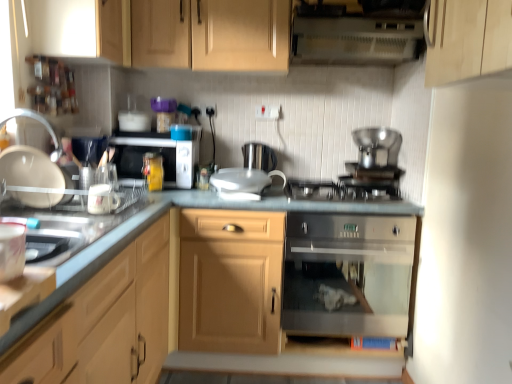
What is the approximate width of wooden cabinet at upper center, marked as the fourth cabinetry in a bottom-to-top arrangement?

24.74 inches.

Image resolution: width=512 pixels, height=384 pixels. What do you see at coordinates (376, 154) in the screenshot?
I see `satin silver pot at center, the 3th appliance positioned from the front` at bounding box center [376, 154].

What is the approximate height of light wood cabinet at upper left, which is the second cabinetry in top-to-bottom order?

light wood cabinet at upper left, which is the second cabinetry in top-to-bottom order, is 13.03 inches tall.

Identify the location of light wood cabinet at upper left, which is the second cabinetry in top-to-bottom order. (83, 29).

What is the approximate width of stainless steel gas stove at center?

stainless steel gas stove at center is 20.91 inches wide.

What do you see at coordinates (348, 273) in the screenshot? I see `stainless steel oven at center` at bounding box center [348, 273].

The height and width of the screenshot is (384, 512). Identify the location of matte white mug at left, the 1th appliance positioned from the front. (12, 250).

Where is `wooden cabinet at upper center, which is counted as the first cabinetry, starting from the top`? The width and height of the screenshot is (512, 384). wooden cabinet at upper center, which is counted as the first cabinetry, starting from the top is located at coordinates (169, 33).

Is wooden cabinet at upper center, marked as the fourth cabinetry in a bottom-to-top arrangement, inside the boundaries of white glossy plate at left, or outside?

wooden cabinet at upper center, marked as the fourth cabinetry in a bottom-to-top arrangement, is spatially situated outside white glossy plate at left.

Based on the photo, can you tell me how much wooden cabinet at upper center, marked as the fourth cabinetry in a bottom-to-top arrangement, and white glossy plate at left differ in facing direction?

There is a 90-degree angle between the facing directions of wooden cabinet at upper center, marked as the fourth cabinetry in a bottom-to-top arrangement, and white glossy plate at left.

From a real-world perspective, is wooden cabinet at upper center, marked as the fourth cabinetry in a bottom-to-top arrangement, on top of white glossy plate at left?

Yes, from a real-world perspective, wooden cabinet at upper center, marked as the fourth cabinetry in a bottom-to-top arrangement, is over white glossy plate at left

Can you confirm if matte white mug at left, placed as the 2th appliance when sorted from right to left, is bigger than satin silver pot at center, arranged as the first appliance when viewed from the top?

Actually, matte white mug at left, placed as the 2th appliance when sorted from right to left, might be smaller than satin silver pot at center, arranged as the first appliance when viewed from the top.

Is matte white mug at left, which appears as the first appliance when ordered from the bottom, not close to satin silver pot at center, the 1th appliance when ordered from right to left?

That's right, there is a large distance between matte white mug at left, which appears as the first appliance when ordered from the bottom, and satin silver pot at center, the 1th appliance when ordered from right to left.

From the image's perspective, does matte white mug at left, acting as the 3th appliance starting from the top, appear lower than satin silver pot at center, the 3th appliance positioned from the front?

Indeed, from the image's perspective, matte white mug at left, acting as the 3th appliance starting from the top, is shown beneath satin silver pot at center, the 3th appliance positioned from the front.

From a real-world perspective, relative to satin silver pot at center, the 1th appliance viewed from the back, is matte white mug at left, placed as the 2th appliance when sorted from right to left, vertically above or below?

In terms of real-world spatial position, matte white mug at left, placed as the 2th appliance when sorted from right to left, is below satin silver pot at center, the 1th appliance viewed from the back.

From a real-world perspective, is matte white mug at left, which appears as the first appliance when ordered from the bottom, positioned over white glossy plate at left based on gravity?

Actually, matte white mug at left, which appears as the first appliance when ordered from the bottom, is physically below white glossy plate at left in the real world.

Can you confirm if matte white mug at left, acting as the second appliance starting from the left, is wider than white glossy plate at left?

No.

Which is in front, matte white mug at left, the 3th appliance viewed from the back, or white glossy plate at left?

matte white mug at left, the 3th appliance viewed from the back, is closer to the camera.

Can you tell me how much matte white mug at left, placed as the 2th appliance when sorted from right to left, and white glossy plate at left differ in facing direction?

The angle between the facing direction of matte white mug at left, placed as the 2th appliance when sorted from right to left, and the facing direction of white glossy plate at left is 121 degrees.

Between light wood cabinet at left, placed as the third cabinetry when sorted from top to bottom, and matte wood cabinet at center, which is the 4th cabinetry from top to bottom, which one has smaller size?

Smaller between the two is light wood cabinet at left, placed as the third cabinetry when sorted from top to bottom.

Is light wood cabinet at left, the second cabinetry from the bottom, wider than matte wood cabinet at center, which is the 4th cabinetry from top to bottom?

No.

Which point is more forward, (42, 321) or (419, 206)?

The point (42, 321) is in front.

From a real-world perspective, who is located lower, light wood cabinet at left, placed as the third cabinetry when sorted from top to bottom, or matte wood cabinet at center, the 1th cabinetry positioned from the bottom?

From a 3D spatial view, matte wood cabinet at center, the 1th cabinetry positioned from the bottom, is below.

Between light wood cabinet at upper left, the third cabinetry ordered from the bottom, and light wood cabinet at left, the second cabinetry from the bottom, which one has less height?

With less height is light wood cabinet at upper left, the third cabinetry ordered from the bottom.

Is light wood cabinet at upper left, the third cabinetry ordered from the bottom, in front of light wood cabinet at left, placed as the third cabinetry when sorted from top to bottom?

No, it is behind light wood cabinet at left, placed as the third cabinetry when sorted from top to bottom.

Consider the image. Between light wood cabinet at upper left, which is the second cabinetry in top-to-bottom order, and light wood cabinet at left, the second cabinetry from the bottom, which one has larger width?

light wood cabinet at left, the second cabinetry from the bottom, is wider.

How different are the orientations of light wood cabinet at upper left, the third cabinetry ordered from the bottom, and light wood cabinet at left, the second cabinetry from the bottom, in degrees?

The angle between the facing direction of light wood cabinet at upper left, the third cabinetry ordered from the bottom, and the facing direction of light wood cabinet at left, the second cabinetry from the bottom, is 0.456 degrees.

Is point (405, 232) behind point (165, 160)?

No.

Are stainless steel oven at center and matte black microwave at center beside each other?

There is a gap between stainless steel oven at center and matte black microwave at center.

Find the location of a particular element. The width and height of the screenshot is (512, 384). microwave oven above the stainless steel oven at center (from the image's perspective) is located at coordinates tap(159, 153).

Could you tell me if stainless steel oven at center is turned towards matte black microwave at center?

No, stainless steel oven at center is not turned towards matte black microwave at center.

Which of these two, matte white mug at left, acting as the 3th appliance starting from the top, or white glossy mug at left, the 2th appliance in the back-to-front sequence, is bigger?

With larger size is matte white mug at left, acting as the 3th appliance starting from the top.

Find the location of `appliance to the left of matte white mug at left, the 3th appliance viewed from the back`. appliance to the left of matte white mug at left, the 3th appliance viewed from the back is located at coordinates (102, 199).

Is point (8, 251) closer or farther from the camera than point (102, 198)?

Point (8, 251) is positioned closer to the camera compared to point (102, 198).

Is matte white mug at left, the 3th appliance viewed from the back, far away from white glossy mug at left, acting as the second appliance starting from the bottom?

They are positioned close to each other.

At what (x,y) coordinates should I click in order to perform the action: click on kitchen appliance that is under the wooden cabinet at upper center, which is counted as the first cabinetry, starting from the top (from a real-world perspective). Please return your answer as a coordinate pair (x, y). This screenshot has height=384, width=512. Looking at the image, I should click on (29, 168).

The width and height of the screenshot is (512, 384). What are the coordinates of `the 2nd appliance behind the matte white mug at left, acting as the 3th appliance starting from the top, counting from the anchor's position` in the screenshot? It's located at (376, 154).

Based on their spatial positions, is matte white mug at left, acting as the second appliance starting from the left, or stainless steel oven at center further from white glossy mug at left, the third appliance when ordered from right to left?

stainless steel oven at center is further to white glossy mug at left, the third appliance when ordered from right to left.

From the image, which object appears to be nearer to matte black microwave at center, satin silver pot at center, the 1th appliance viewed from the back, or matte white mug at left, the 3th appliance viewed from the back?

Based on the image, satin silver pot at center, the 1th appliance viewed from the back, appears to be nearer to matte black microwave at center.

From the picture: Estimate the real-world distances between objects in this image. Which object is further from wooden cabinet at upper center, marked as the fourth cabinetry in a bottom-to-top arrangement, matte white mug at left, acting as the 3th appliance starting from the top, or white plastic vent at upper center?

The object further to wooden cabinet at upper center, marked as the fourth cabinetry in a bottom-to-top arrangement, is matte white mug at left, acting as the 3th appliance starting from the top.

Estimate the real-world distances between objects in this image. Which object is further from stainless steel oven at center, matte white mug at left, placed as the 2th appliance when sorted from right to left, or satin silver pot at center, arranged as the first appliance when viewed from the top?

matte white mug at left, placed as the 2th appliance when sorted from right to left, lies further to stainless steel oven at center than the other object.

From the image, which object appears to be farther from satin silver pot at center, acting as the third appliance starting from the bottom, light wood cabinet at upper left, which is the second cabinetry in top-to-bottom order, or stainless steel gas stove at center?

light wood cabinet at upper left, which is the second cabinetry in top-to-bottom order, is further to satin silver pot at center, acting as the third appliance starting from the bottom.

When comparing their distances from matte wood cabinet at center, the 1th cabinetry positioned from the bottom, does light wood cabinet at upper left, the third cabinetry ordered from the bottom, or white glossy plate at left seem closer?

The object closer to matte wood cabinet at center, the 1th cabinetry positioned from the bottom, is white glossy plate at left.

Considering their positions, is white plastic vent at upper center positioned further to stainless steel gas stove at center than white glossy mug at left, the 1th appliance when ordered from left to right?

Based on the image, white glossy mug at left, the 1th appliance when ordered from left to right, appears to be further to stainless steel gas stove at center.

From the image, which object appears to be farther from satin silver pot at center, the 3th appliance positioned from the front, matte wood cabinet at center, which is the 4th cabinetry from top to bottom, or white plastic vent at upper center?

Based on the image, white plastic vent at upper center appears to be further to satin silver pot at center, the 3th appliance positioned from the front.

Where is `vent between matte wood cabinet at center, which is the 4th cabinetry from top to bottom, and stainless steel gas stove at center from front to back`? Image resolution: width=512 pixels, height=384 pixels. vent between matte wood cabinet at center, which is the 4th cabinetry from top to bottom, and stainless steel gas stove at center from front to back is located at coordinates (356, 32).

Where is `kitchen appliance between wooden cabinet at upper center, which is counted as the first cabinetry, starting from the top, and white glossy mug at left, the 1th appliance when ordered from left to right, in the vertical direction`? This screenshot has height=384, width=512. kitchen appliance between wooden cabinet at upper center, which is counted as the first cabinetry, starting from the top, and white glossy mug at left, the 1th appliance when ordered from left to right, in the vertical direction is located at coordinates [29, 168].

Locate an element on the screen. vent between white glossy mug at left, positioned as the second appliance in top-to-bottom order, and satin silver pot at center, arranged as the first appliance when viewed from the top, from left to right is located at coordinates (356, 32).

This screenshot has width=512, height=384. What are the coordinates of `appliance between wooden cabinet at upper center, which is counted as the first cabinetry, starting from the top, and stainless steel gas stove at center in the up-down direction` in the screenshot? It's located at (376, 154).